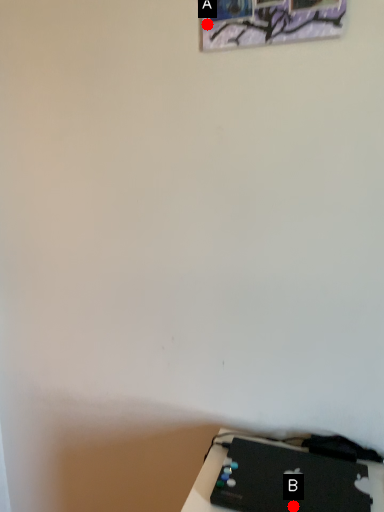
Question: Two points are circled on the image, labeled by A and B beside each circle. Which point is closer to the camera?

Choices:
 (A) A is closer
 (B) B is closer

Answer: (B)